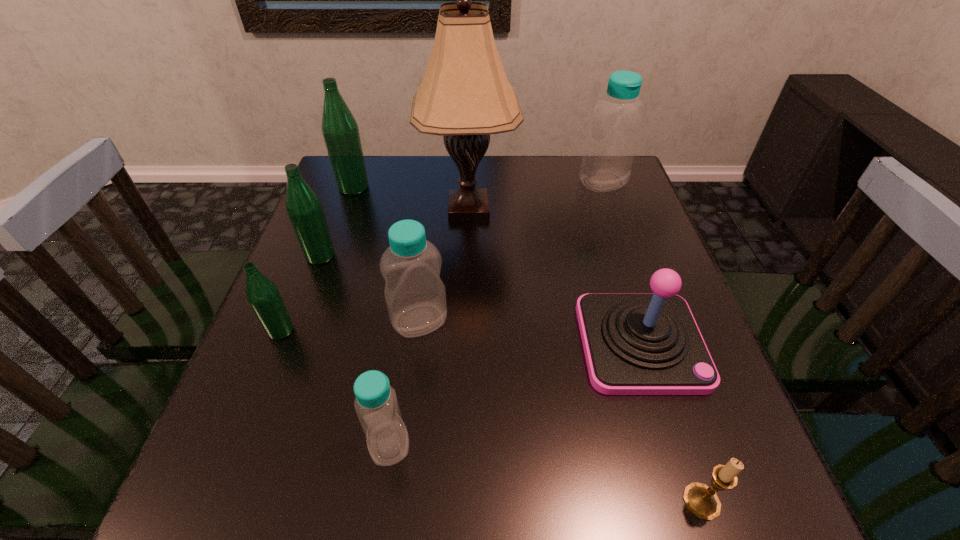
Identify which green bottle is the second nearest to the second farthest green bottle. Please provide its 2D coordinates. Your answer should be formatted as a tuple, i.e. [(x, y)], where the tuple contains the x and y coordinates of a point satisfying the conditions above.

[(340, 131)]

Locate an element on the screen. The height and width of the screenshot is (540, 960). green bottle that is the third closest to the tallest object is located at coordinates (262, 294).